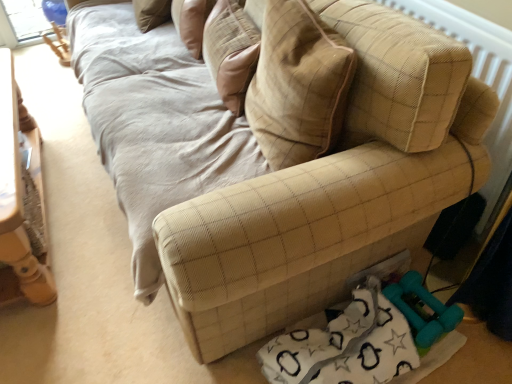
Question: Can you confirm if beige quilted pillow at center is wider than wooden table at left?

Choices:
 (A) yes
 (B) no

Answer: (B)

Question: From the image's perspective, is beige quilted pillow at center on top of wooden table at left?

Choices:
 (A) no
 (B) yes

Answer: (B)

Question: Can you confirm if beige quilted pillow at center is positioned to the left of wooden table at left?

Choices:
 (A) no
 (B) yes

Answer: (A)

Question: Is beige quilted pillow at center not within wooden table at left?

Choices:
 (A) no
 (B) yes

Answer: (B)

Question: Is beige quilted pillow at center further to camera compared to wooden table at left?

Choices:
 (A) yes
 (B) no

Answer: (B)

Question: In terms of width, does beige quilted pillow at center look wider or thinner when compared to wooden table at left?

Choices:
 (A) thin
 (B) wide

Answer: (A)

Question: From a real-world perspective, relative to wooden table at left, is beige quilted pillow at center vertically above or below?

Choices:
 (A) above
 (B) below

Answer: (A)

Question: Considering the positions of beige quilted pillow at center and wooden table at left in the image, is beige quilted pillow at center taller or shorter than wooden table at left?

Choices:
 (A) tall
 (B) short

Answer: (A)

Question: Is beige quilted pillow at center inside or outside of wooden table at left?

Choices:
 (A) outside
 (B) inside

Answer: (A)

Question: In terms of size, does beige fabric radiator at upper right appear bigger or smaller than beige textured pillow at upper center?

Choices:
 (A) small
 (B) big

Answer: (B)

Question: Is point (489, 29) closer or farther from the camera than point (185, 6)?

Choices:
 (A) closer
 (B) farther

Answer: (A)

Question: From the image's perspective, is beige fabric radiator at upper right located above or below beige textured pillow at upper center?

Choices:
 (A) above
 (B) below

Answer: (B)

Question: Is beige fabric radiator at upper right taller or shorter than beige textured pillow at upper center?

Choices:
 (A) tall
 (B) short

Answer: (A)

Question: Is beige textured pillow at upper center in front of or behind teal rubber dumbbells at lower right in the image?

Choices:
 (A) front
 (B) behind

Answer: (B)

Question: Considering the positions of point (210, 3) and point (296, 342), is point (210, 3) closer or farther from the camera than point (296, 342)?

Choices:
 (A) farther
 (B) closer

Answer: (A)